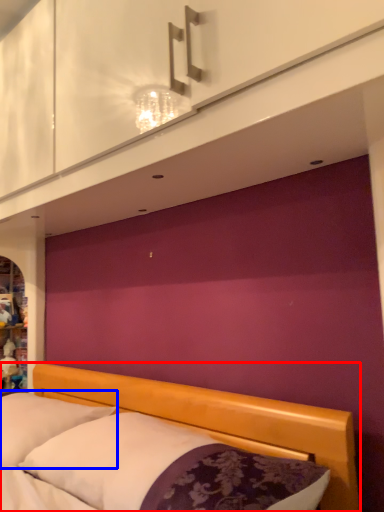
Question: Which of the following is the closest to the observer, bed (highlighted by a red box) or pillow (highlighted by a blue box)?

Choices:
 (A) bed
 (B) pillow

Answer: (A)